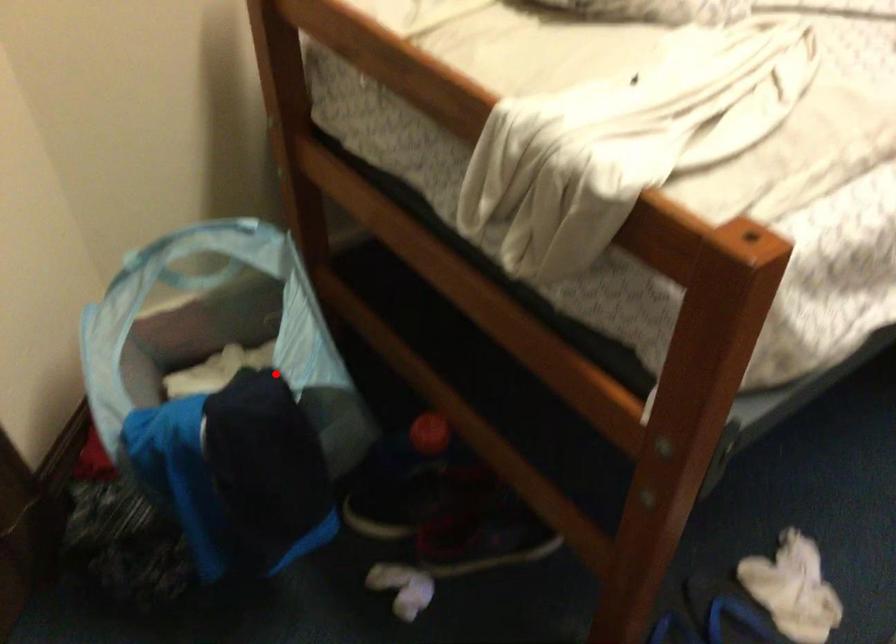
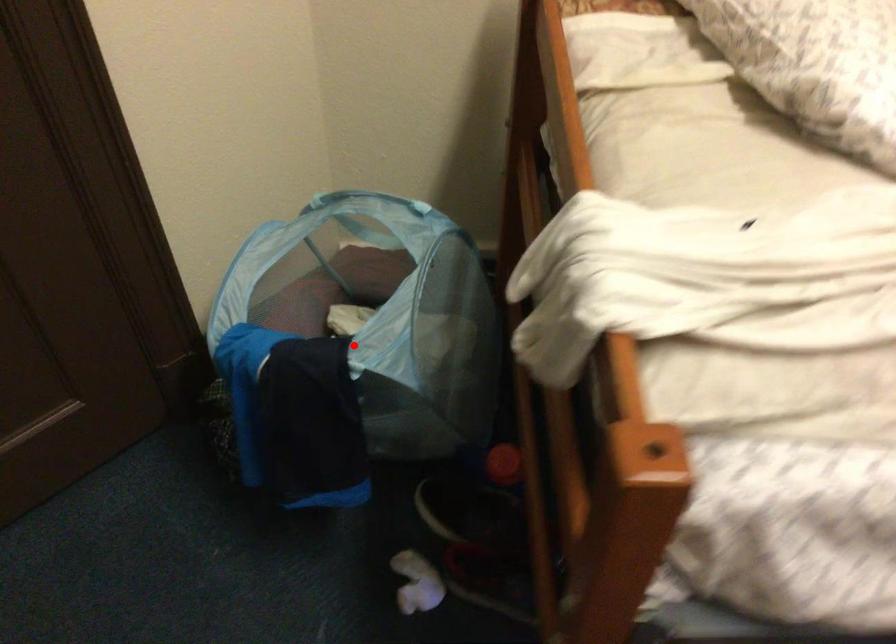
I am providing you with two images of the same scene from different viewpoints. A red point is marked on the first image and another point is marked on the second image. Are the points marked in image1 and image2 representing the same 3D position?

Yes